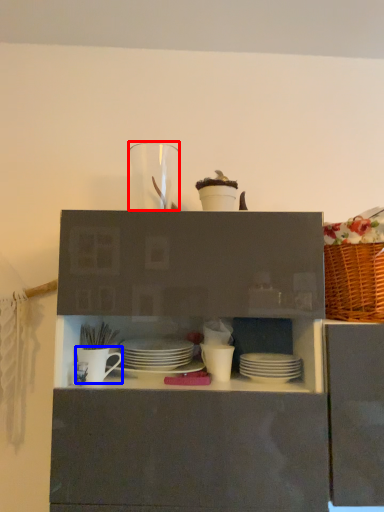
Question: Among these objects, which one is nearest to the camera, tableware (highlighted by a red box) or tableware (highlighted by a blue box)?

Choices:
 (A) tableware
 (B) tableware

Answer: (B)